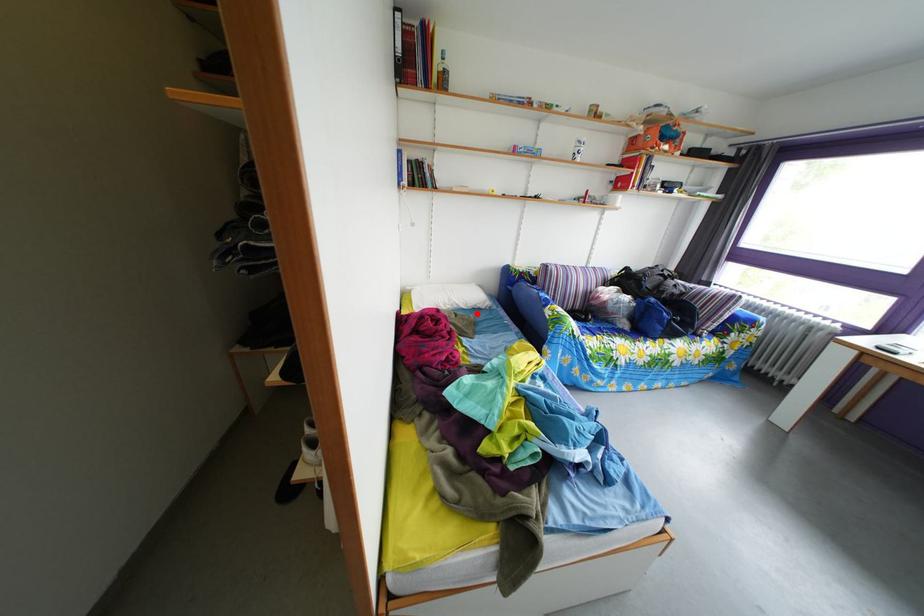
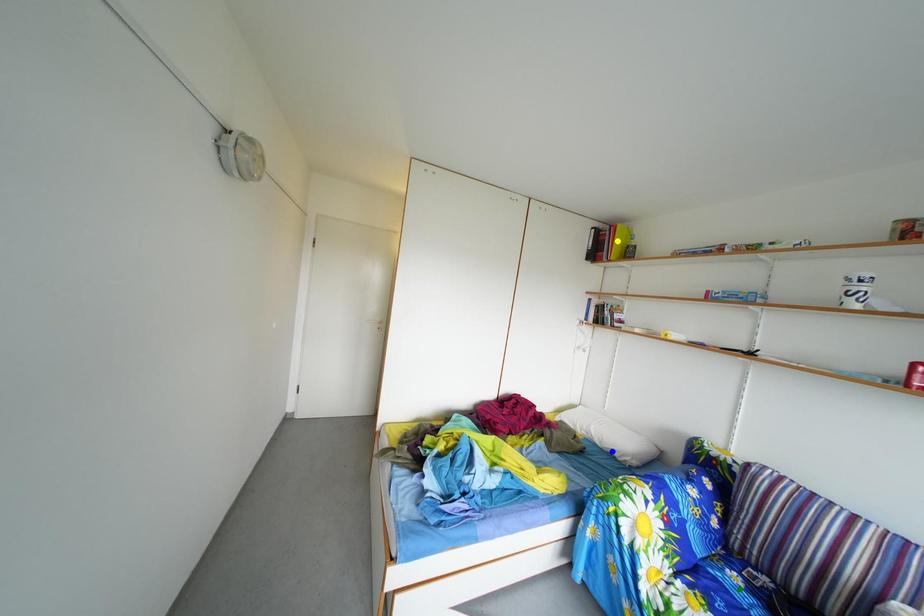
Question: I am providing you with two images of the same scene from different viewpoints. A red point is marked on the first image. You are given multiple points on the second image. Which mark in image 2 goes with the point in image 1?

Choices:
 (A) yellow point
 (B) green point
 (C) blue point

Answer: (C)